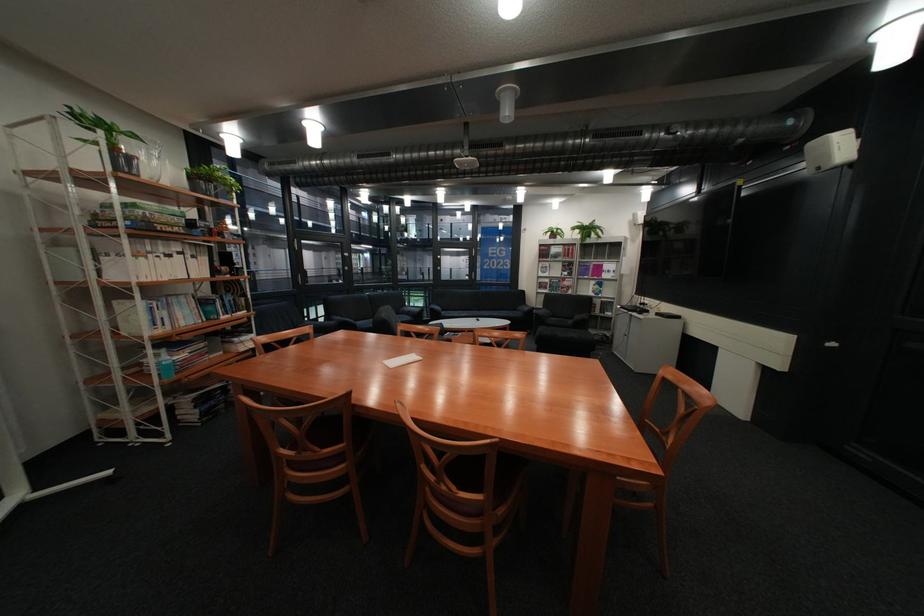
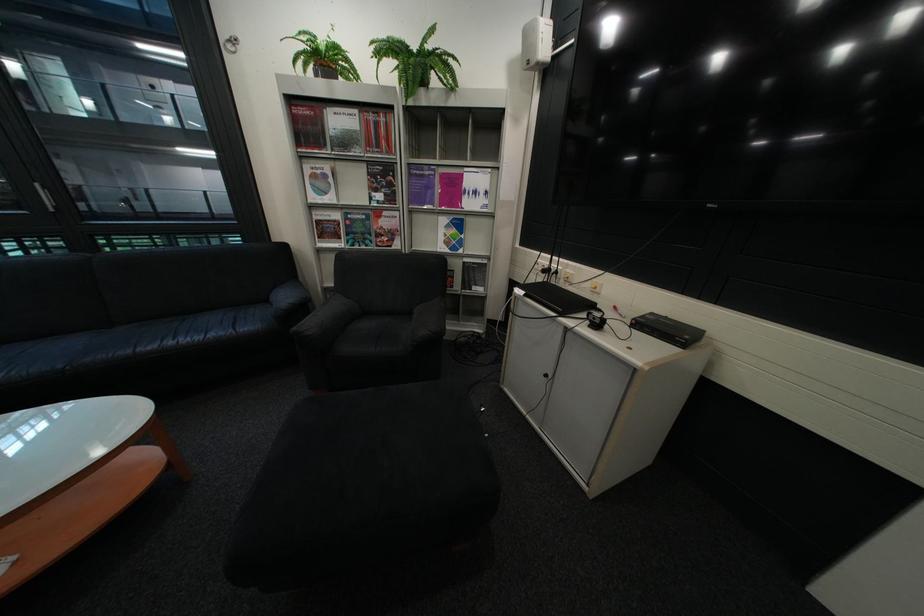
In the second image, find the point that corresponds to the point at 557,257 in the first image.

(322, 147)